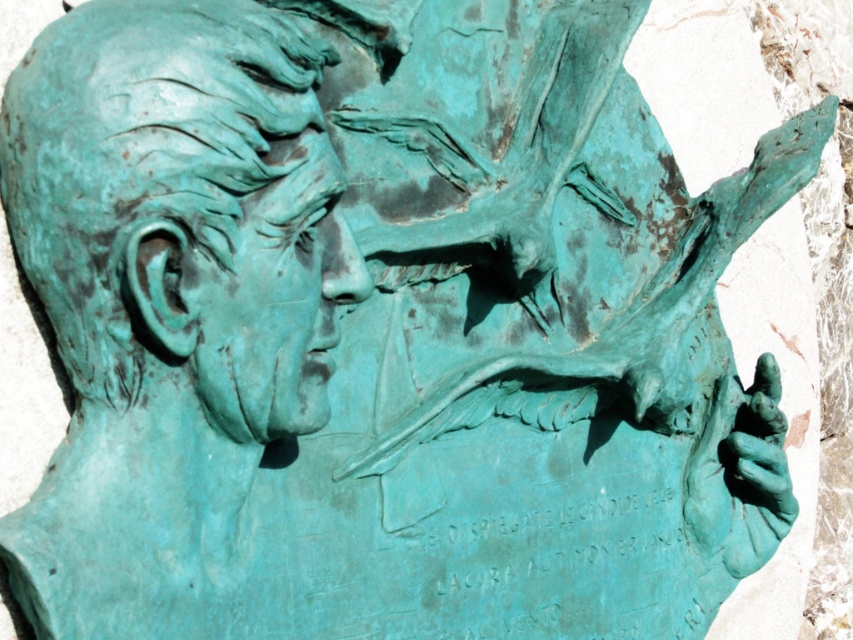
Question: Does green patina bust at center lie in front of green patina face at center?

Choices:
 (A) yes
 (B) no

Answer: (A)

Question: Among these objects, which one is farthest from the camera?

Choices:
 (A) green patina face at center
 (B) green patina bust at center

Answer: (A)

Question: Can you confirm if green patina bust at center is positioned below green patina face at center?

Choices:
 (A) yes
 (B) no

Answer: (B)

Question: Can you confirm if green patina bust at center is bigger than green patina face at center?

Choices:
 (A) no
 (B) yes

Answer: (B)